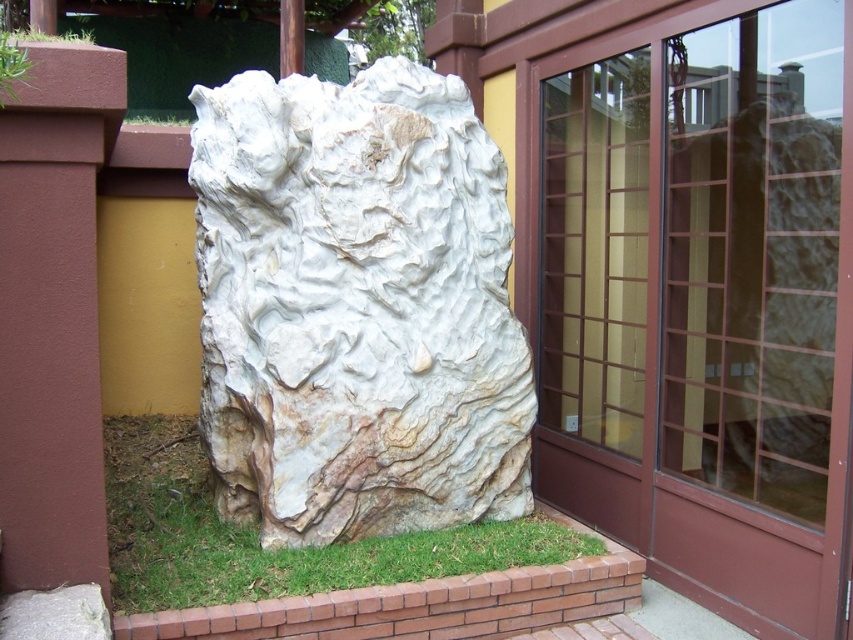
You are standing at the point closest to the building. Which of the two points, point (236,108) or point (0,48), is farther away from you?

Point (236,108) is farther away from you because it is behind point (0,48).

You are standing in front of the rock and want to walk towards the green leafy grass at upper left. Which direction should you move relative to the green grass at lower left?

To reach the green leafy grass at upper left, you should move towards the upper direction relative to the green grass at lower left, as the green leafy grass at upper left is positioned behind the green grass at lower left.